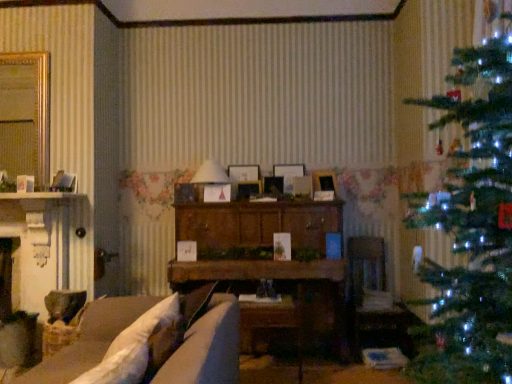
Question: Should I look upward or downward to see wooden picture frame at center, marked as the 2th picture frame in a right-to-left arrangement?

Choices:
 (A) down
 (B) up

Answer: (B)

Question: Does white paper lampshade at center have a larger size compared to wooden picture frame at center, the 4th picture frame when ordered from right to left?

Choices:
 (A) yes
 (B) no

Answer: (A)

Question: From the image's perspective, does white paper lampshade at center appear higher than wooden picture frame at center, the 4th picture frame when ordered from right to left?

Choices:
 (A) no
 (B) yes

Answer: (B)

Question: Would you consider white paper lampshade at center to be distant from wooden picture frame at center, which appears as the second picture frame when viewed from the left?

Choices:
 (A) yes
 (B) no

Answer: (B)

Question: Considering the relative sizes of white paper lampshade at center and wooden picture frame at center, the 4th picture frame when ordered from right to left, in the image provided, is white paper lampshade at center thinner than wooden picture frame at center, the 4th picture frame when ordered from right to left,?

Choices:
 (A) no
 (B) yes

Answer: (A)

Question: Is white paper lampshade at center in front of wooden picture frame at center, which appears as the second picture frame when viewed from the left?

Choices:
 (A) no
 (B) yes

Answer: (B)

Question: From the image's perspective, does white paper lampshade at center appear lower than wooden picture frame at center, which appears as the second picture frame when viewed from the left?

Choices:
 (A) no
 (B) yes

Answer: (A)

Question: Is velvet beige couch at lower left at the back of velvet brown armchair at center?

Choices:
 (A) no
 (B) yes

Answer: (A)

Question: Is velvet brown armchair at center shorter than velvet beige couch at lower left?

Choices:
 (A) no
 (B) yes

Answer: (A)

Question: Is velvet brown armchair at center not close to velvet beige couch at lower left?

Choices:
 (A) yes
 (B) no

Answer: (A)

Question: Can you confirm if velvet brown armchair at center is smaller than velvet beige couch at lower left?

Choices:
 (A) no
 (B) yes

Answer: (B)

Question: Considering the relative sizes of velvet brown armchair at center and velvet beige couch at lower left in the image provided, is velvet brown armchair at center wider than velvet beige couch at lower left?

Choices:
 (A) yes
 (B) no

Answer: (B)

Question: From a real-world perspective, is velvet brown armchair at center below velvet beige couch at lower left?

Choices:
 (A) yes
 (B) no

Answer: (A)

Question: Does white paper lampshade at center have a lesser width compared to wooden cabinet at center?

Choices:
 (A) yes
 (B) no

Answer: (A)